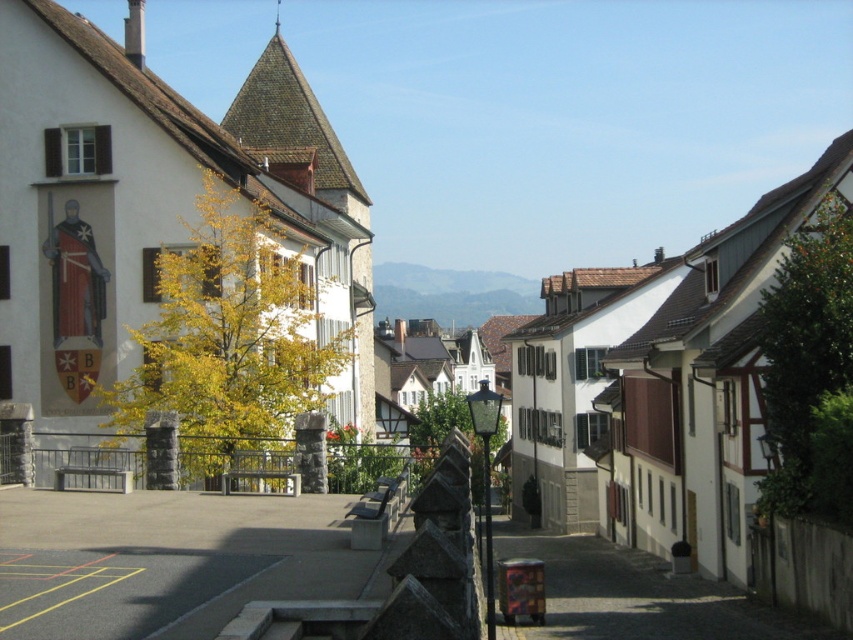
Who is taller, yellow leafy tree at left or green leafy tree at right?

yellow leafy tree at left

Who is positioned more to the left, yellow leafy tree at left or green leafy tree at right?

yellow leafy tree at left

Describe the element at coordinates (229, 337) in the screenshot. This screenshot has width=853, height=640. I see `yellow leafy tree at left` at that location.

At what (x,y) coordinates should I click in order to perform the action: click on yellow leafy tree at left. Please return your answer as a coordinate pair (x, y). This screenshot has height=640, width=853. Looking at the image, I should click on (229, 337).